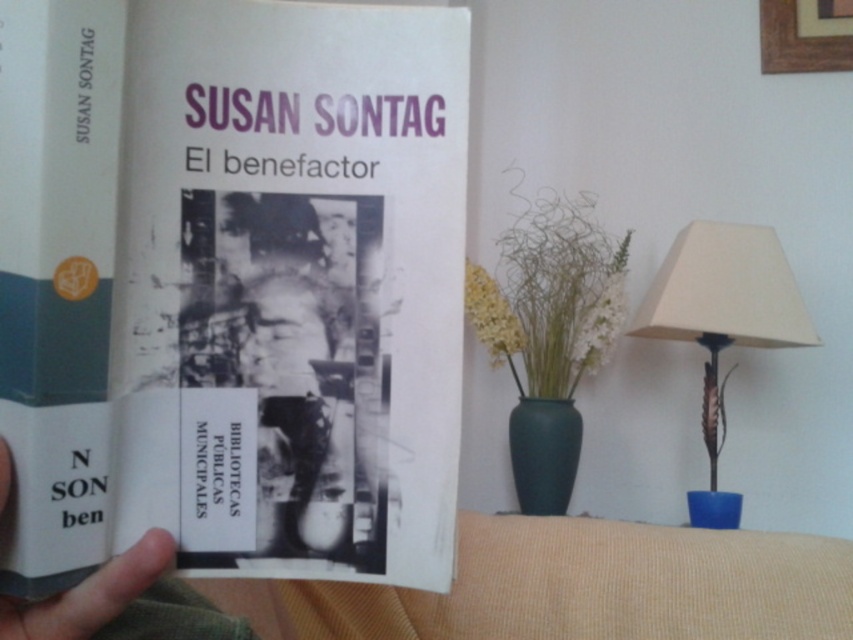
Based on the photo, you are standing in the library and see two points marked in the image. The first point is at coordinate point [10,593], and the second is at point [148,579]. Which point is closer to you?

Point [10,593] is in front of point [148,579], so the first point is closer to you.

You are organizing a bookshelf and want to place the hardcover book at center next to the beige fabric lampshade at right. Since the lampshade is taller, where should you position the book relative to the lampshade to maintain visual balance?

Since the hardcover book at center is shorter than the beige fabric lampshade at right, you should place the hardcover book at center closer to the edge of the shelf and the beige fabric lampshade at right further inward to balance their heights.

You are an interior designer assessing the lighting in a room. You see a beige fabric lampshade at right and a gray matte finger at center. Which object has a greater width?

The beige fabric lampshade at right has a greater width than the gray matte finger at center.